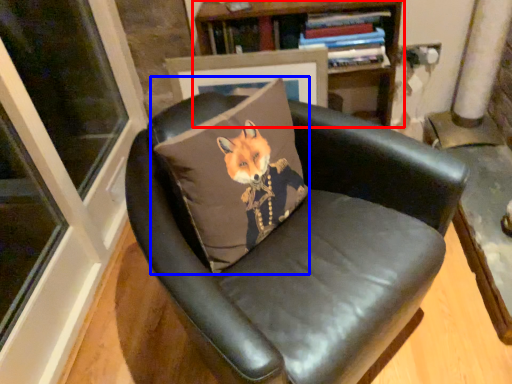
Question: Which object is further to the camera taking this photo, bookcase (highlighted by a red box) or throw pillow (highlighted by a blue box)?

Choices:
 (A) bookcase
 (B) throw pillow

Answer: (A)